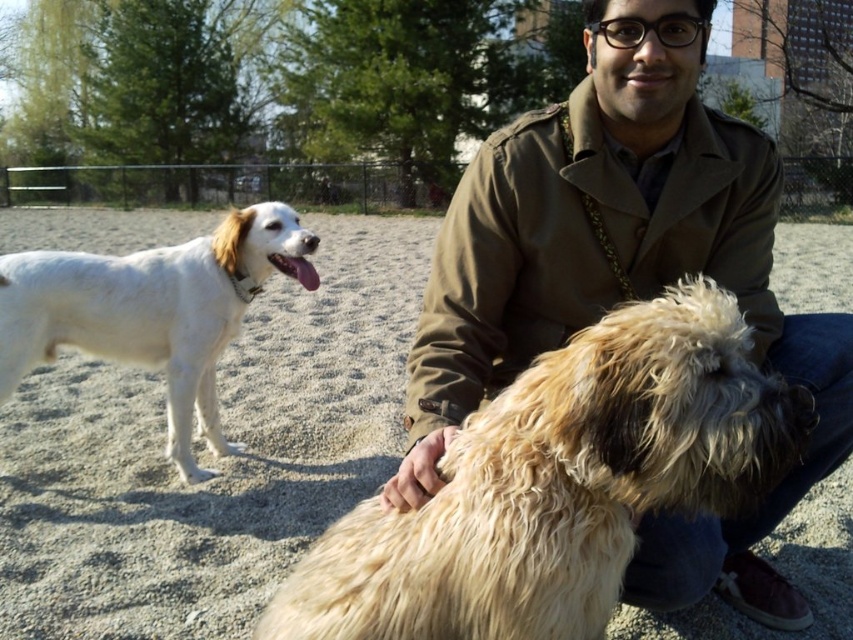
Does point (323, 586) come farther from viewer compared to point (184, 408)?

No.

Is fluffy beige dog at center shorter than white fur dog at left?

Yes.

Is point (692, 337) positioned in front of point (222, 259)?

That is True.

Find the location of a particular element. fluffy beige dog at center is located at coordinates (560, 484).

Is brown textured coat at center to the right of fluffy beige dog at center from the viewer's perspective?

Correct, you'll find brown textured coat at center to the right of fluffy beige dog at center.

The width and height of the screenshot is (853, 640). Describe the element at coordinates (624, 278) in the screenshot. I see `brown textured coat at center` at that location.

Find the location of `brown textured coat at center`. brown textured coat at center is located at coordinates (624, 278).

Can you confirm if brown textured coat at center is positioned to the right of white fur dog at left?

Indeed, brown textured coat at center is positioned on the right side of white fur dog at left.

Which is above, brown textured coat at center or white fur dog at left?

Positioned higher is white fur dog at left.

Does point (494, 273) lie in front of point (166, 404)?

Yes.

Locate an element on the screen. The width and height of the screenshot is (853, 640). brown textured coat at center is located at coordinates (624, 278).